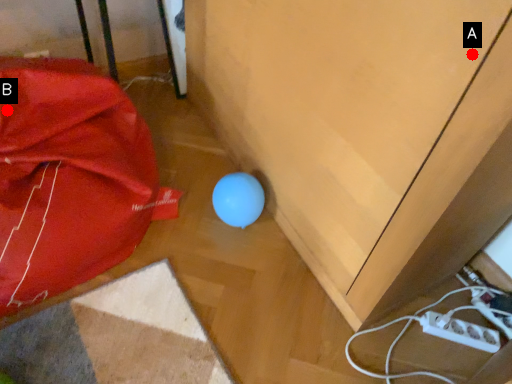
Question: Two points are circled on the image, labeled by A and B beside each circle. Which point is farther to the camera?

Choices:
 (A) A is further
 (B) B is further

Answer: (B)